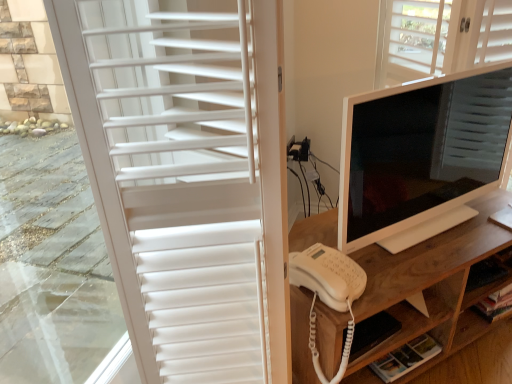
Image resolution: width=512 pixels, height=384 pixels. Identify the location of vacant area to the right of white plastic telephone at center. (387, 268).